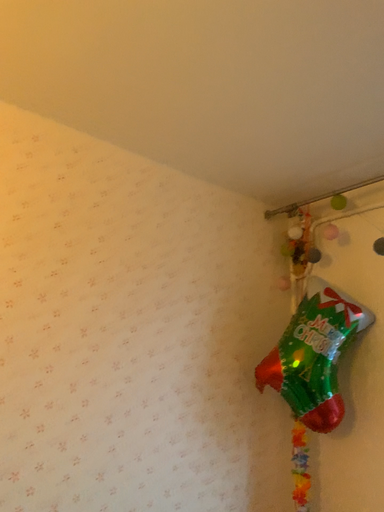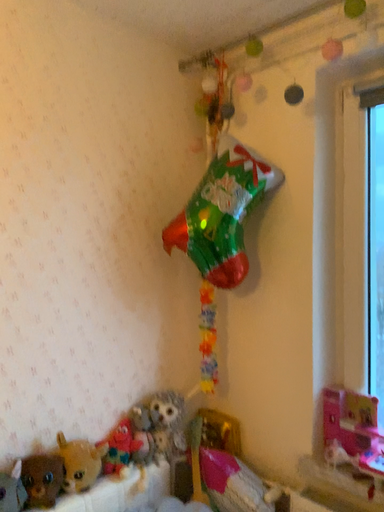
Question: Which way did the camera rotate in the video?

Choices:
 (A) rotated downward
 (B) rotated upward

Answer: (A)